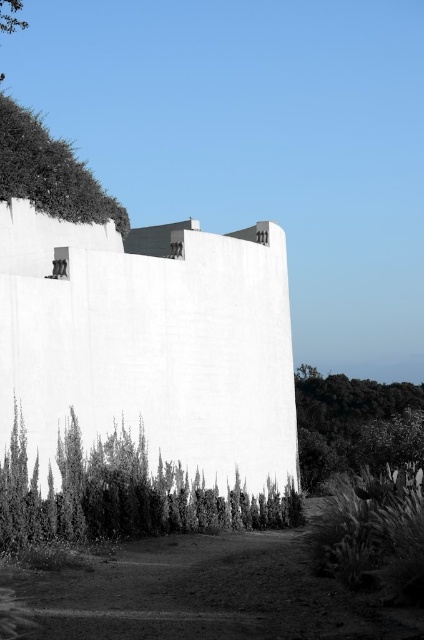
Between green leafy tree at lower right and green leafy tree at upper left, which one appears on the left side from the viewer's perspective?

green leafy tree at upper left is more to the left.

Describe the element at coordinates (348, 422) in the screenshot. The image size is (424, 640). I see `green leafy tree at lower right` at that location.

Image resolution: width=424 pixels, height=640 pixels. I want to click on green leafy tree at lower right, so click(x=348, y=422).

Based on the photo, does green leafy shrub at lower left appear on the left side of green leafy tree at lower right?

Correct, you'll find green leafy shrub at lower left to the left of green leafy tree at lower right.

Which is more to the left, green leafy shrub at lower left or green leafy tree at lower right?

green leafy shrub at lower left

You are a GUI agent. You are given a task and a screenshot of the screen. Output one action in this format:
    pyautogui.click(x=<x>, y=<y>)
    Task: Click on the green leafy shrub at lower left
    The height and width of the screenshot is (640, 424).
    Given the screenshot: What is the action you would take?
    pyautogui.click(x=122, y=496)

Can you confirm if green leafy shrub at lower left is wider than green leafy tree at upper left?

No.

Is point (204, 486) less distant than point (7, 16)?

Yes, point (204, 486) is in front of point (7, 16).

Between point (16, 440) and point (11, 1), which one is positioned in front?

Point (16, 440) is in front.

This screenshot has height=640, width=424. Find the location of `green leafy shrub at lower left`. green leafy shrub at lower left is located at coordinates (122, 496).